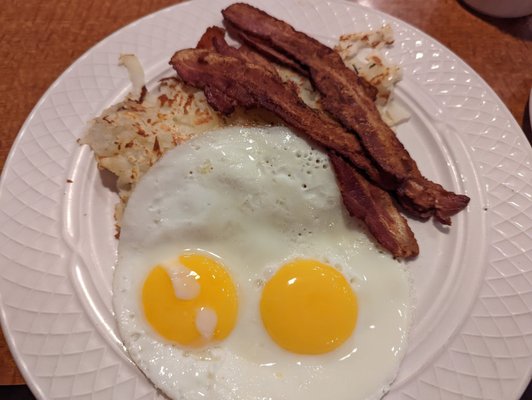
Locate an element on the screen. The image size is (532, 400). mug is located at coordinates (498, 8).